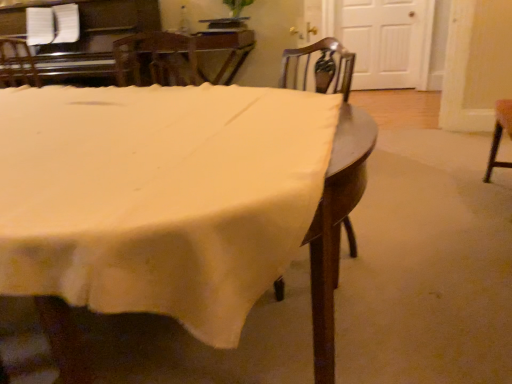
Question: From a real-world perspective, is white fabric table at center located beneath wooden at center?

Choices:
 (A) no
 (B) yes

Answer: (B)

Question: Does white fabric table at center have a greater width compared to wooden at center?

Choices:
 (A) no
 (B) yes

Answer: (B)

Question: Is wooden at center a part of white fabric table at center?

Choices:
 (A) no
 (B) yes

Answer: (B)

Question: From a real-world perspective, is white fabric table at center on wooden at center?

Choices:
 (A) no
 (B) yes

Answer: (A)

Question: Is white fabric table at center further to camera compared to wooden at center?

Choices:
 (A) yes
 (B) no

Answer: (B)

Question: Is there a large distance between white fabric table at center and wooden at center?

Choices:
 (A) yes
 (B) no

Answer: (B)

Question: Does wooden at center have a greater width compared to white fabric table at center?

Choices:
 (A) yes
 (B) no

Answer: (B)

Question: Is wooden at center not inside white fabric table at center?

Choices:
 (A) yes
 (B) no

Answer: (B)

Question: Can you confirm if wooden at center is smaller than white fabric table at center?

Choices:
 (A) no
 (B) yes

Answer: (B)

Question: Is the depth of wooden at center greater than that of white fabric table at center?

Choices:
 (A) yes
 (B) no

Answer: (A)

Question: Is white fabric table at center surrounded by wooden at center?

Choices:
 (A) no
 (B) yes

Answer: (A)

Question: From the image's perspective, does wooden at center appear higher than white fabric table at center?

Choices:
 (A) yes
 (B) no

Answer: (A)

Question: Does point [x=207, y=153] appear closer or farther from the camera than point [x=327, y=59]?

Choices:
 (A) closer
 (B) farther

Answer: (A)